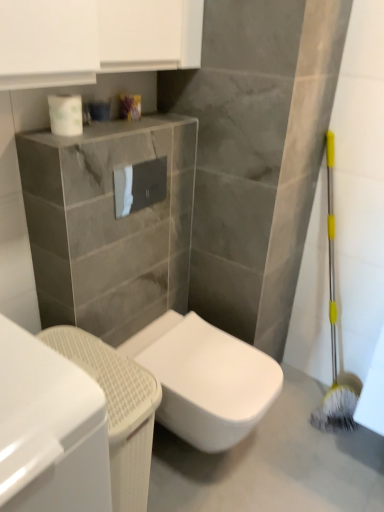
Image resolution: width=384 pixels, height=512 pixels. Find the location of `free point above white glossy toilet at center (from a real-world perspective)`. free point above white glossy toilet at center (from a real-world perspective) is located at coordinates (196, 355).